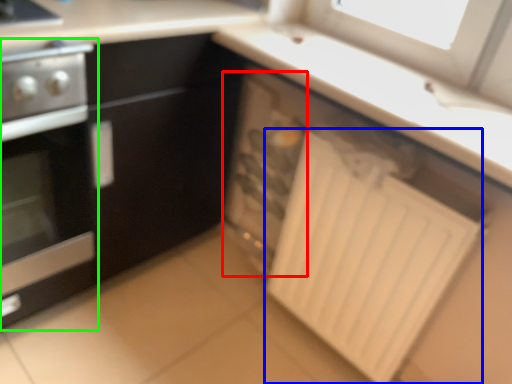
Question: Considering the real-world distances, which object is farthest from appliance (highlighted by a red box)? radiator (highlighted by a blue box) or home appliance (highlighted by a green box)?

Choices:
 (A) radiator
 (B) home appliance

Answer: (B)